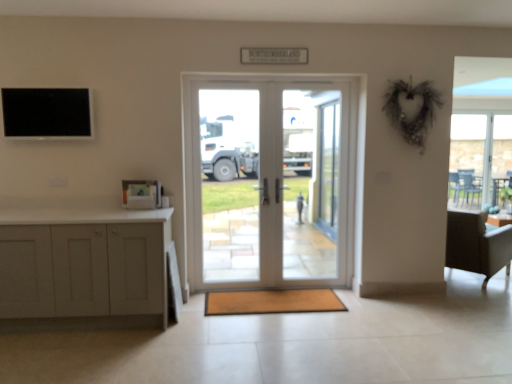
Question: Can you confirm if transparent glass table at right is bigger than brown textured mat at center?

Choices:
 (A) yes
 (B) no

Answer: (A)

Question: Can you confirm if transparent glass table at right is shorter than brown textured mat at center?

Choices:
 (A) no
 (B) yes

Answer: (A)

Question: Does transparent glass table at right have a greater height compared to brown textured mat at center?

Choices:
 (A) no
 (B) yes

Answer: (B)

Question: Is transparent glass table at right touching brown textured mat at center?

Choices:
 (A) no
 (B) yes

Answer: (A)

Question: Is there a large distance between transparent glass table at right and brown textured mat at center?

Choices:
 (A) yes
 (B) no

Answer: (A)

Question: Looking at their shapes, would you say brown textured mat at center is wider or thinner than white glass door at center?

Choices:
 (A) thin
 (B) wide

Answer: (B)

Question: Considering the relative positions of brown textured mat at center and white glass door at center in the image provided, is brown textured mat at center to the left or to the right of white glass door at center?

Choices:
 (A) left
 (B) right

Answer: (A)

Question: In terms of size, does brown textured mat at center appear bigger or smaller than white glass door at center?

Choices:
 (A) small
 (B) big

Answer: (A)

Question: From a real-world perspective, is brown textured mat at center physically located above or below white glass door at center?

Choices:
 (A) below
 (B) above

Answer: (A)

Question: Is brown textured mat at center to the left or to the right of light gray fabric chair at right in the image?

Choices:
 (A) right
 (B) left

Answer: (B)

Question: Based on their sizes in the image, would you say brown textured mat at center is bigger or smaller than light gray fabric chair at right?

Choices:
 (A) small
 (B) big

Answer: (A)

Question: Considering the positions of point 240,292 and point 480,273, is point 240,292 closer or farther from the camera than point 480,273?

Choices:
 (A) farther
 (B) closer

Answer: (B)

Question: From their relative heights in the image, would you say brown textured mat at center is taller or shorter than light gray fabric chair at right?

Choices:
 (A) tall
 (B) short

Answer: (B)

Question: From the image's perspective, is white glass door at center located above or below transparent glass door at center, arranged as the second screen door when viewed from the back?

Choices:
 (A) above
 (B) below

Answer: (A)

Question: Considering their positions, is white glass door at center located in front of or behind transparent glass door at center, which ranks as the 2th screen door in right-to-left order?

Choices:
 (A) behind
 (B) front

Answer: (B)